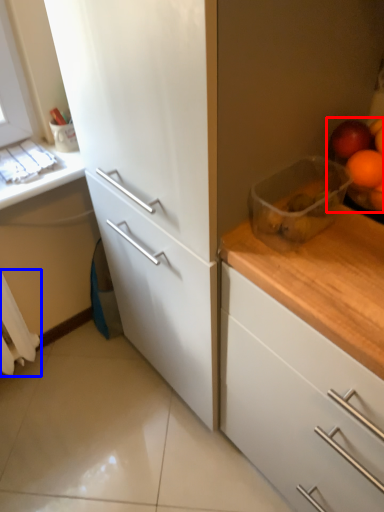
Question: Among these objects, which one is nearest to the camera, fruit (highlighted by a red box) or curtain (highlighted by a blue box)?

Choices:
 (A) fruit
 (B) curtain

Answer: (A)